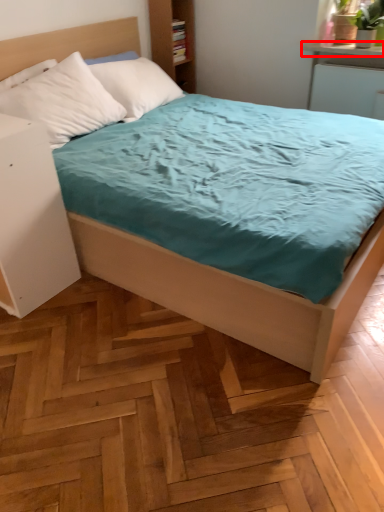
Question: Considering the relative positions of window sill (annotated by the red box) and nightstand in the image provided, where is window sill (annotated by the red box) located with respect to the staircase?

Choices:
 (A) right
 (B) left

Answer: (A)